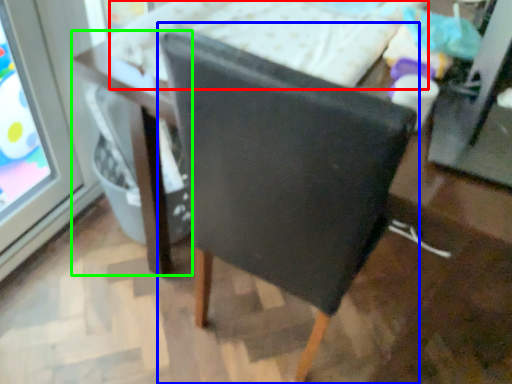
Question: Which is nearer to the bed (highlighted by a red box)? chair (highlighted by a blue box) or table (highlighted by a green box).

Choices:
 (A) chair
 (B) table

Answer: (B)